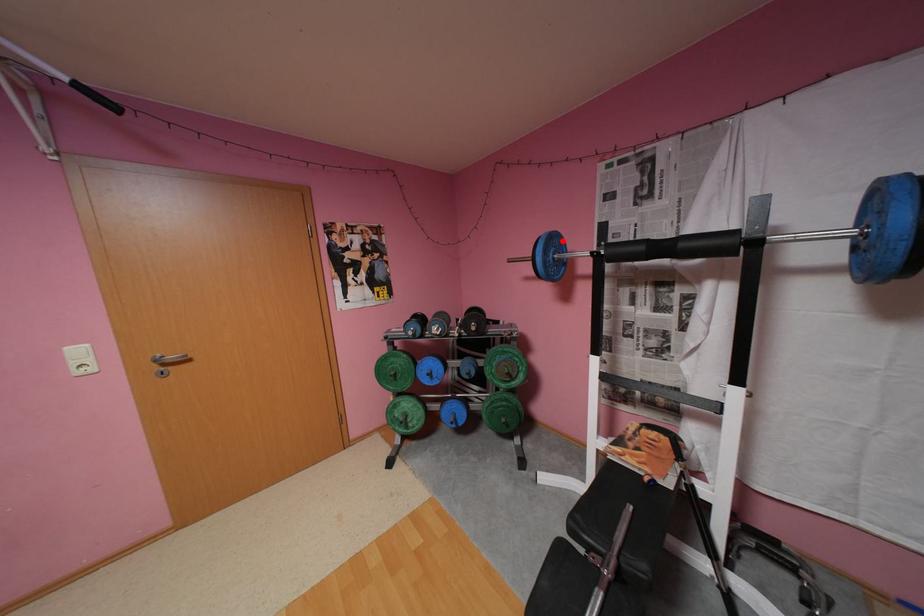
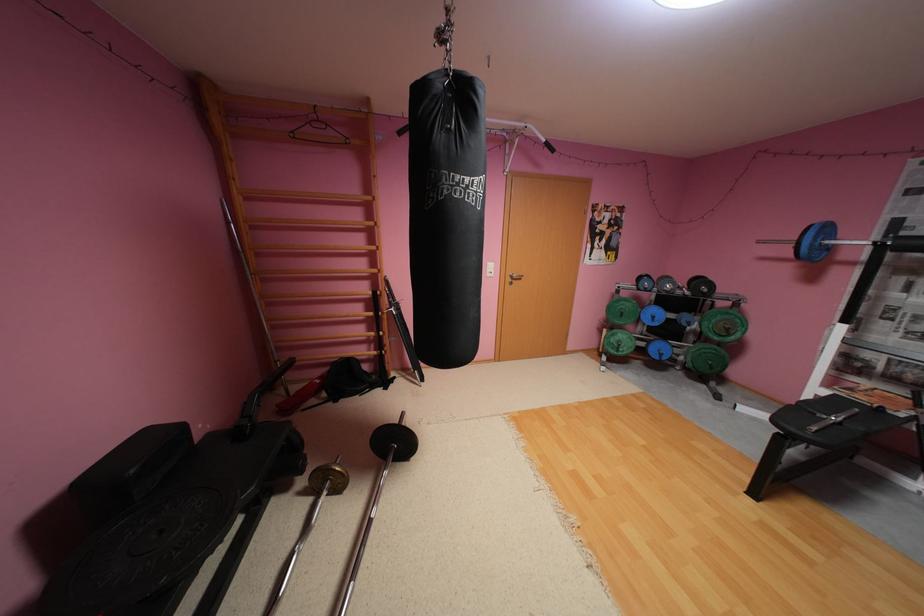
Question: I am providing you with two images of the same scene from different viewpoints. Image1 has a red point marked. In image2, the corresponding 3D location appears at what relative position? Reply with the corresponding letter.

Choices:
 (A) Closer
 (B) Farther

Answer: (B)